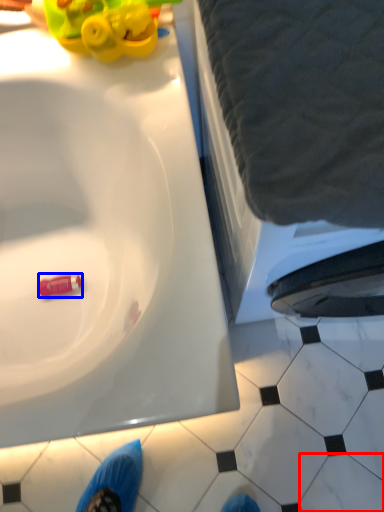
Question: Which object is further to the camera taking this photo, tile (highlighted by a red box) or toy (highlighted by a blue box)?

Choices:
 (A) tile
 (B) toy

Answer: (B)